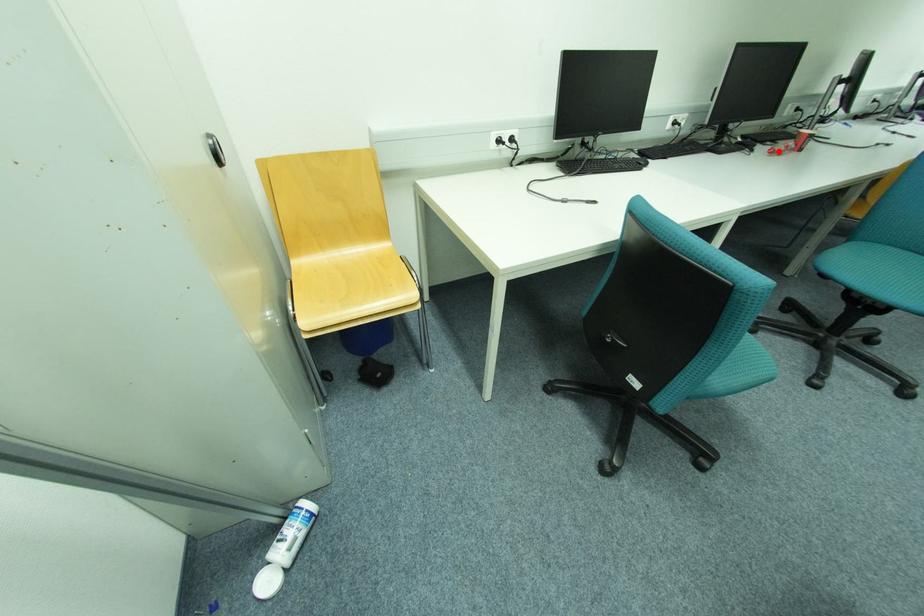
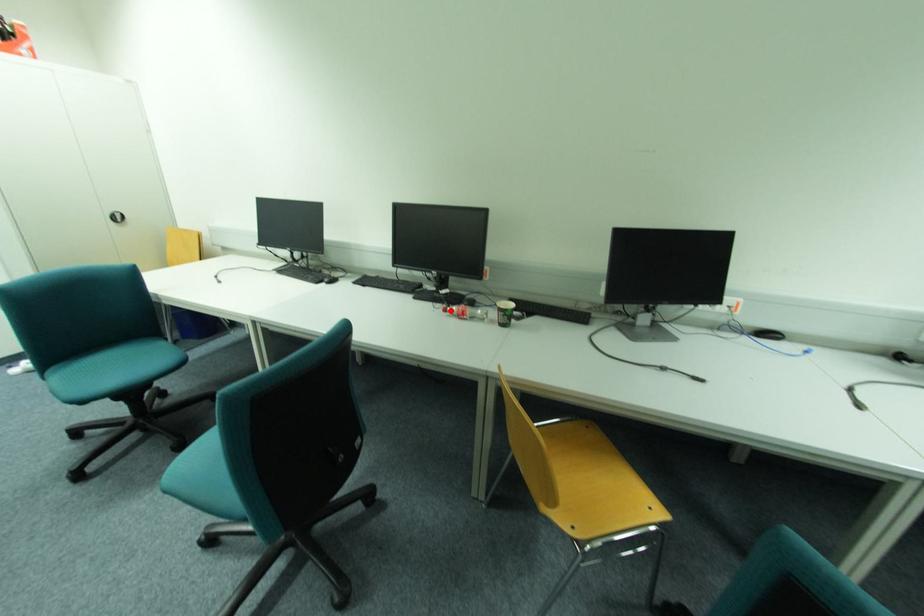
From the picture: I am providing you with two images of the same scene from different viewpoints. A red point is marked on the first image and another point is marked on the second image. Are the points marked in image1 and image2 representing the same 3D position?

Yes